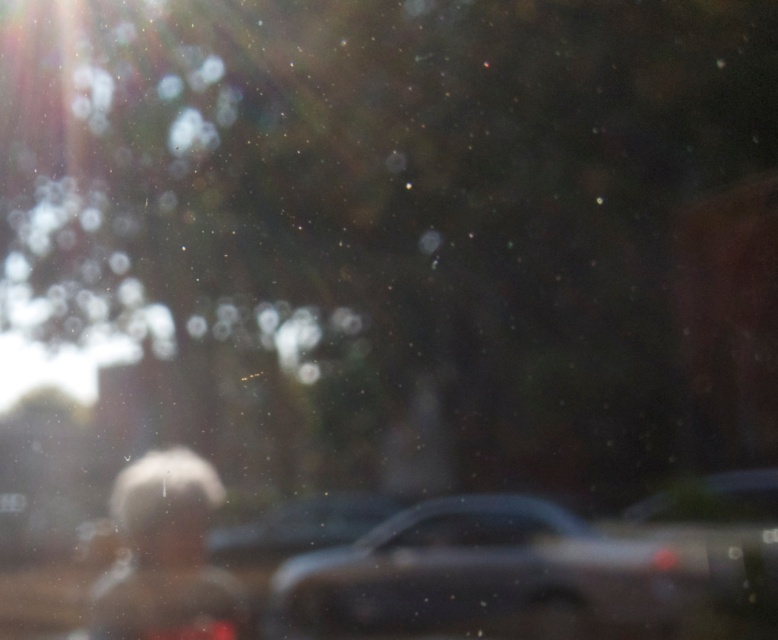
You are a passenger in a car and looking out the window. You notice a metallic gray car at center in the scene. Based on the coordinates provided, can you estimate its location relative to your current position?

The metallic gray car at center is located at coordinates point (486,577), which places it near the lower right area of the window view. Since you are inside the vehicle, this position suggests the car is likely ahead and to your right side relative to your current position in the car.

You are a passenger in a moving car and notice two objects in the scene through the window. Which object, the white matte hair at center or the transparent glass car window at center, is taller?

The white matte hair at center is taller than the transparent glass car window at center.

You are a passenger in a car and notice the metallic gray car at center and the transparent glass car window at center. Which object is closer to the bottom edge of the image?

The metallic gray car at center is closer to the bottom edge of the image because it is positioned below the transparent glass car window at center.